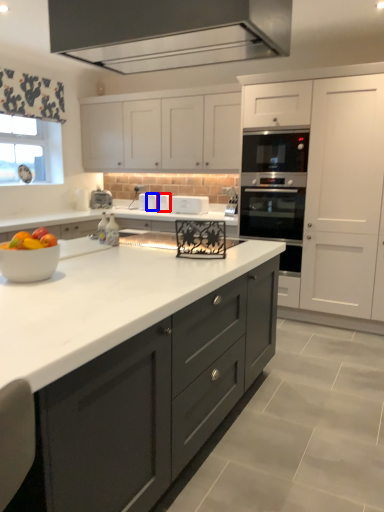
Question: Which point is further to the camera, appliance (highlighted by a red box) or appliance (highlighted by a blue box)?

Choices:
 (A) appliance
 (B) appliance

Answer: (B)